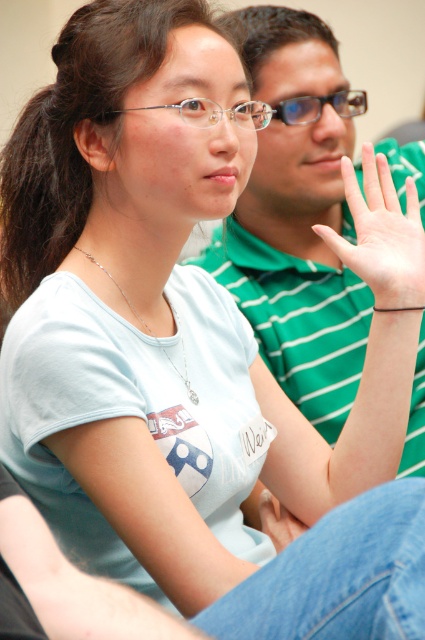
Does green striped shirt at upper center come behind pale skin hand at center?

Yes, it is.

Who is taller, green striped shirt at upper center or pale skin hand at center?

With more height is green striped shirt at upper center.

Between point (340, 324) and point (416, 291), which one is positioned behind?

The point (340, 324) is behind.

You are a GUI agent. You are given a task and a screenshot of the screen. Output one action in this format:
    pyautogui.click(x=<x>, y=<y>)
    Task: Click on the green striped shirt at upper center
    This screenshot has height=640, width=425.
    Given the screenshot: What is the action you would take?
    pyautogui.click(x=299, y=268)

Who is more distant from viewer, (282, 138) or (187, 115)?

The point (282, 138) is more distant.

Locate an element on the screen. green striped shirt at upper center is located at coordinates (299, 268).

Between pale skin hand at center and clear plastic glasses at upper center, which one appears on the left side from the viewer's perspective?

From the viewer's perspective, clear plastic glasses at upper center appears more on the left side.

Can you confirm if pale skin hand at center is shorter than clear plastic glasses at upper center?

No, pale skin hand at center is not shorter than clear plastic glasses at upper center.

I want to click on pale skin hand at center, so click(x=382, y=236).